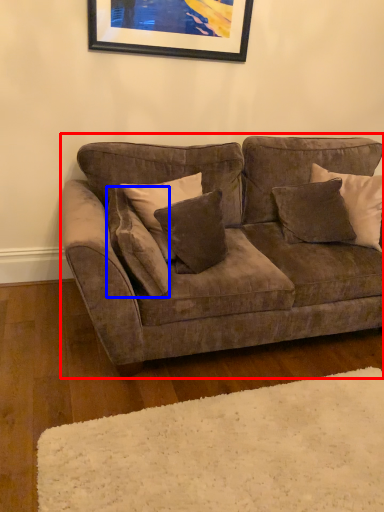
Question: Which object appears farthest to the camera in this image, studio couch (highlighted by a red box) or pillow (highlighted by a blue box)?

Choices:
 (A) studio couch
 (B) pillow

Answer: (B)